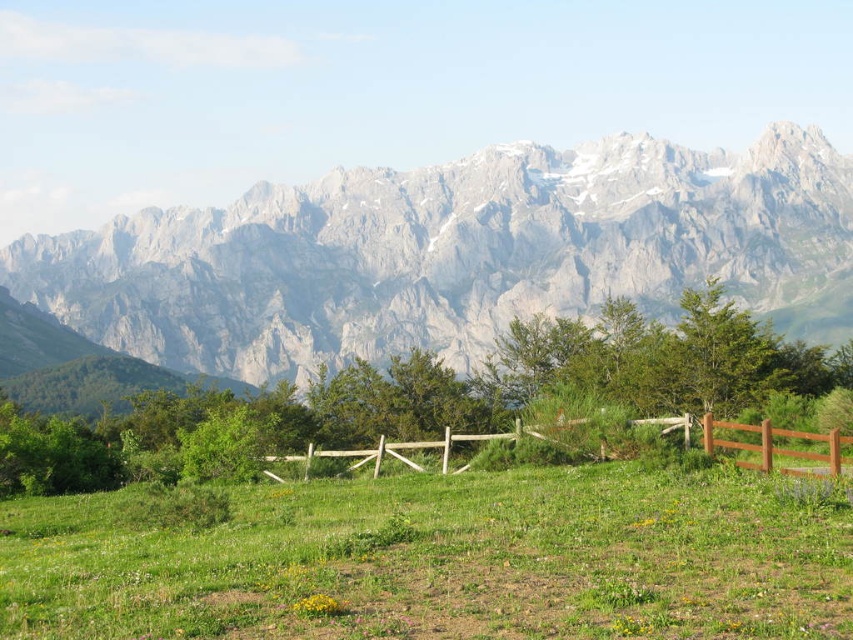
You are a landscape architect designing a new park. You have to place a 10m wide garden in the image. Given the green grassy pasture at center and brown wooden fence at center, which area can accommodate the garden without exceeding its width?

The green grassy pasture at center has a larger width than the brown wooden fence at center, so the garden can be placed on the green grassy pasture at center since it is wider and can accommodate the 10m width.

You are a hiker planning to take a photo of the gray rocky mountain range at upper center and the green grassy pasture at center from a viewpoint. Which object will appear larger in the photo?

The gray rocky mountain range at upper center will appear larger in the photo because it has a greater height compared to the green grassy pasture at center.